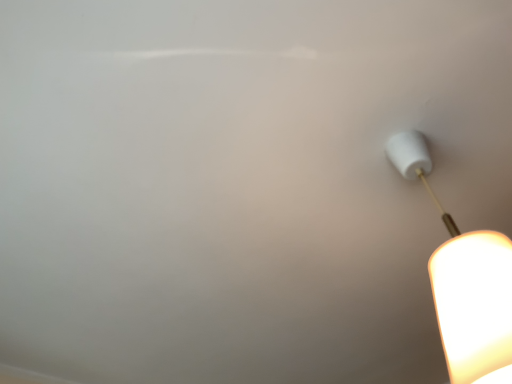
Image resolution: width=512 pixels, height=384 pixels. Describe the element at coordinates (465, 283) in the screenshot. I see `white matte lampshade at upper right` at that location.

Where is `white matte lampshade at upper right`? white matte lampshade at upper right is located at coordinates (465, 283).

Find the location of a particular element. white matte lampshade at upper right is located at coordinates (465, 283).